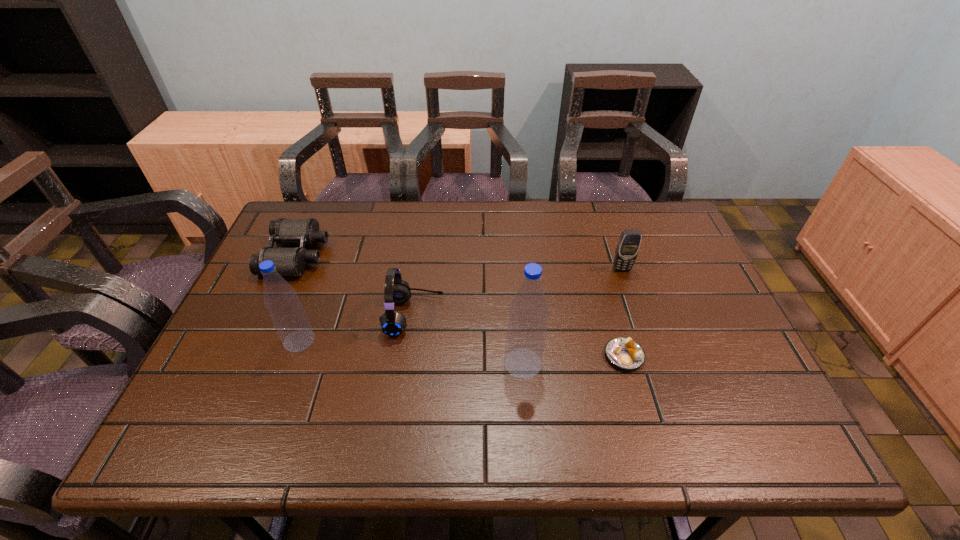
The width and height of the screenshot is (960, 540). What are the coordinates of `vacant space situated on the front face of the cellular telephone` in the screenshot? It's located at (630, 293).

The width and height of the screenshot is (960, 540). Identify the location of vacant space situated on the ear cushions of the headset. (466, 315).

Find the location of a particular element. Image resolution: width=960 pixels, height=540 pixels. free space located on the back of the shortest object is located at coordinates (601, 275).

The width and height of the screenshot is (960, 540). Identify the location of vacant space located through the eyepieces of the fifth tallest object. (393, 255).

Identify the location of object at the far edge. The image size is (960, 540). (288, 261).

At what (x,y) coordinates should I click in order to perform the action: click on object present at the near edge. Please return your answer as a coordinate pair (x, y). Looking at the image, I should click on (528, 313).

You are a GUI agent. You are given a task and a screenshot of the screen. Output one action in this format:
    pyautogui.click(x=<x>, y=<y>)
    Task: Click on the water bottle at the left edge
    The width and height of the screenshot is (960, 540).
    Given the screenshot: What is the action you would take?
    pyautogui.click(x=287, y=314)

This screenshot has height=540, width=960. I want to click on binoculars that is at the left edge, so click(x=288, y=261).

Where is `object at the far left corner`? Image resolution: width=960 pixels, height=540 pixels. object at the far left corner is located at coordinates (288, 261).

In the image, there is a desktop. Where is `vacant space at the far edge`? vacant space at the far edge is located at coordinates (405, 222).